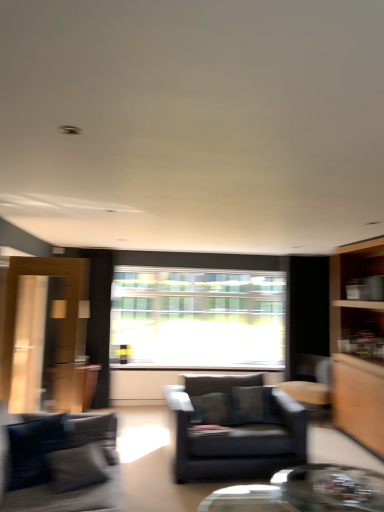
Question: From a real-world perspective, is transparent glass window at center positioned above or below matte black armchair at center?

Choices:
 (A) below
 (B) above

Answer: (B)

Question: Considering the positions of transparent glass window at center and matte black armchair at center in the image, is transparent glass window at center taller or shorter than matte black armchair at center?

Choices:
 (A) short
 (B) tall

Answer: (B)

Question: Estimate the real-world distances between objects in this image. Which object is farther from the matte black armchair at center?

Choices:
 (A) transparent glass coffee table at lower center
 (B) matte wood cabinet at left
 (C) dark blue fabric couch at lower left
 (D) transparent glass window at center

Answer: (B)

Question: Which object is positioned closest to the dark blue fabric couch at lower left?

Choices:
 (A) matte black armchair at center
 (B) transparent glass window at center
 (C) transparent glass coffee table at lower center
 (D) matte wood cabinet at left

Answer: (A)